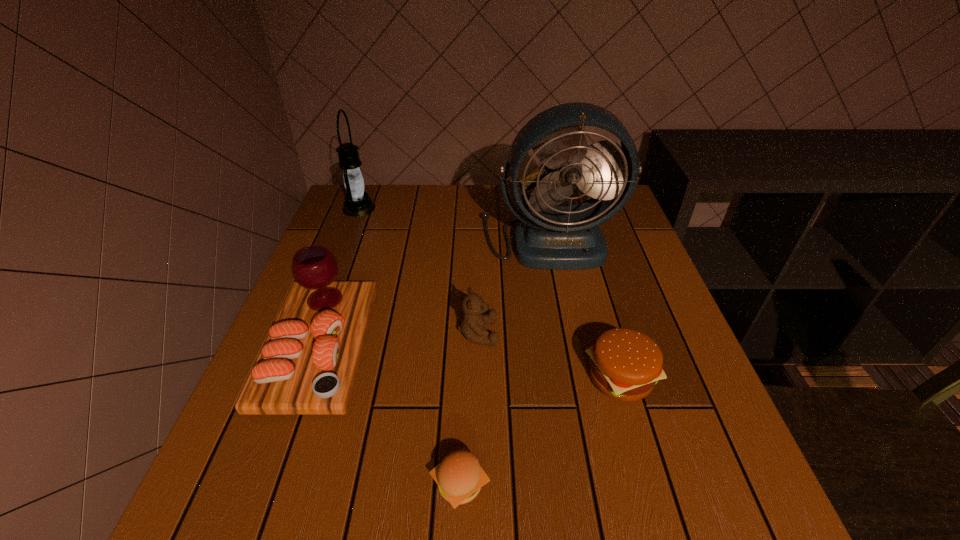
At what (x,y) coordinates should I click in order to perform the action: click on vacant space located 0.270m on the back of the platter. Please return your answer as a coordinate pair (x, y). The height and width of the screenshot is (540, 960). Looking at the image, I should click on (362, 228).

This screenshot has width=960, height=540. Find the location of `free space located 0.360m on the front-facing side of the teddy bear`. free space located 0.360m on the front-facing side of the teddy bear is located at coordinates (664, 333).

Where is `blank space located 0.210m on the front of the second shortest object`? This screenshot has height=540, width=960. blank space located 0.210m on the front of the second shortest object is located at coordinates (665, 533).

The width and height of the screenshot is (960, 540). I want to click on blank space located on the back of the nearer hamburger, so click(463, 394).

You are a GUI agent. You are given a task and a screenshot of the screen. Output one action in this format:
    pyautogui.click(x=<x>, y=<y>)
    Task: Click on the fan that is at the far edge
    
    Given the screenshot: What is the action you would take?
    pyautogui.click(x=554, y=237)

Where is `lantern that is positioned at the far edge`? lantern that is positioned at the far edge is located at coordinates (358, 203).

Identify the location of object at the near edge. (459, 477).

This screenshot has height=540, width=960. Identify the location of lantern located in the left edge section of the desktop. (358, 203).

Where is `platter situated at the left edge`? This screenshot has height=540, width=960. platter situated at the left edge is located at coordinates (308, 364).

In order to click on fan that is at the right edge in this screenshot , I will do `click(554, 237)`.